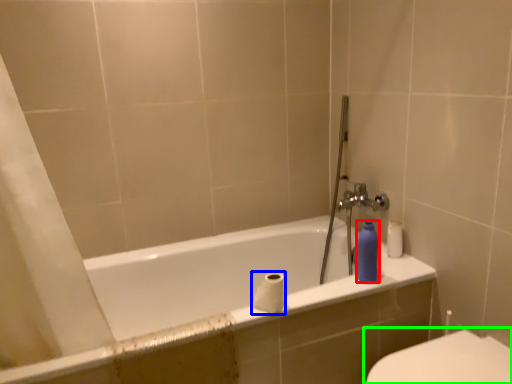
Question: Which is farther away from toiletry (highlighted by a red box)? toilet paper (highlighted by a blue box) or toilet (highlighted by a green box)?

Choices:
 (A) toilet paper
 (B) toilet

Answer: (B)